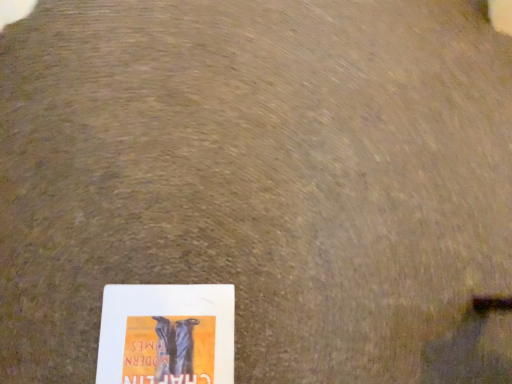
Describe the element at coordinates (167, 334) in the screenshot. I see `orange paper poster at lower left` at that location.

Where is `orange paper poster at lower left`? orange paper poster at lower left is located at coordinates (167, 334).

In order to click on orange paper poster at lower left in this screenshot , I will do `click(167, 334)`.